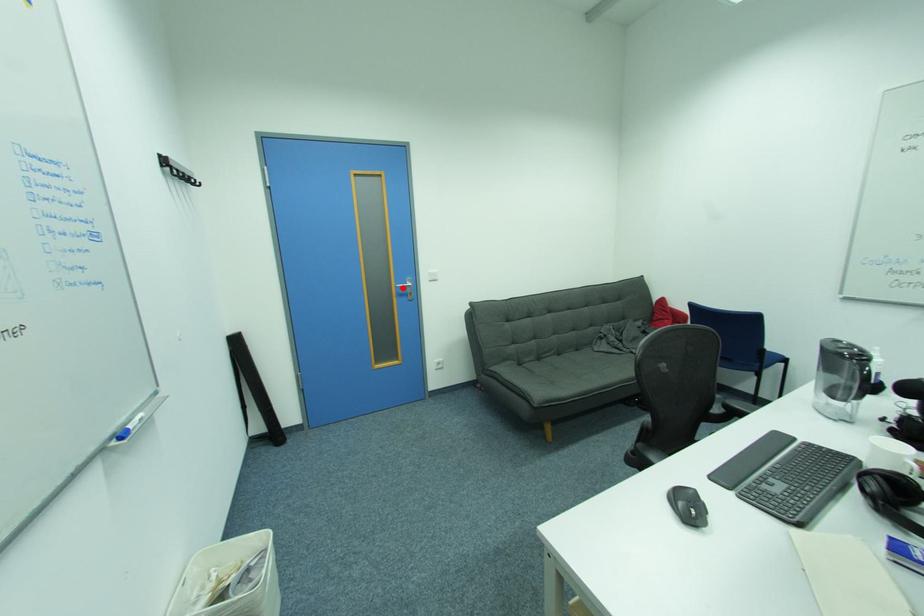
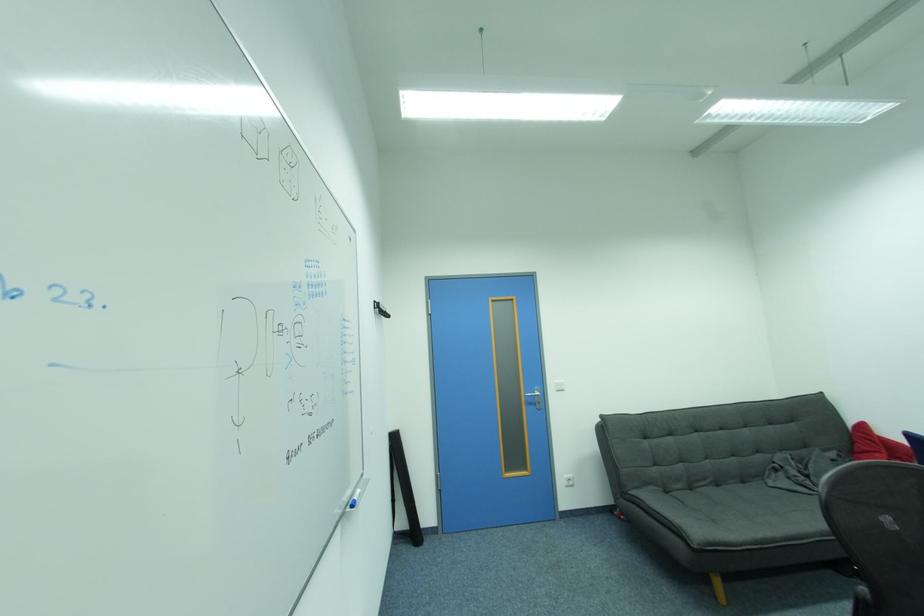
Question: A red point is marked in image1. In image2, is the corresponding 3D point closer to the camera or farther? Reply with the corresponding letter.

Choices:
 (A) The corresponding 3D point is closer.
 (B) The corresponding 3D point is farther.

Answer: (B)